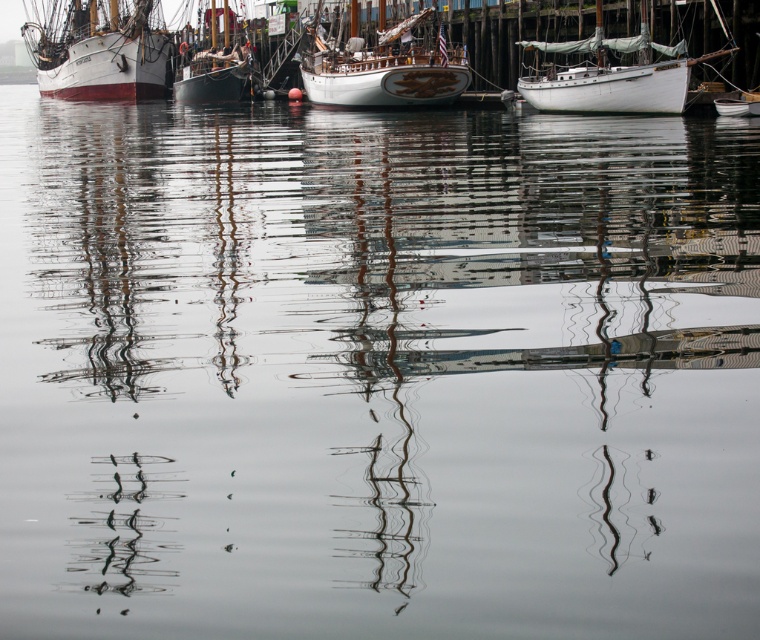
Question: Does white wooden ship at left have a greater width compared to white polished wood boat at center?

Choices:
 (A) yes
 (B) no

Answer: (A)

Question: Which object appears farthest from the camera in this image?

Choices:
 (A) white wooden ship at left
 (B) white polished wood boat at center
 (C) white matte sailboat at upper right
 (D) wooden sailboat at center

Answer: (D)

Question: Can you confirm if white matte sailboat at upper right is positioned to the left of white polished wood boat at center?

Choices:
 (A) yes
 (B) no

Answer: (B)

Question: Which point is farther to the camera?

Choices:
 (A) (209, 54)
 (B) (420, 84)

Answer: (A)

Question: Does white polished wood boat at center appear on the left side of wooden sailboat at center?

Choices:
 (A) yes
 (B) no

Answer: (B)

Question: Which object appears closest to the camera in this image?

Choices:
 (A) wooden sailboat at center
 (B) white wooden ship at left

Answer: (B)